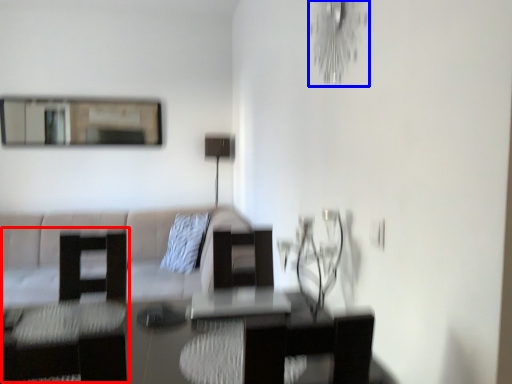
Question: Among these objects, which one is nearest to the camera, swivel chair (highlighted by a red box) or light fixture (highlighted by a blue box)?

Choices:
 (A) swivel chair
 (B) light fixture

Answer: (B)